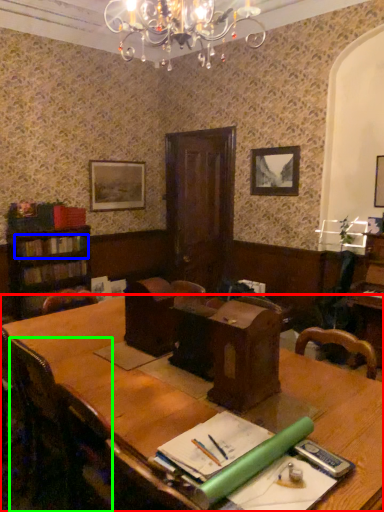
Question: Which is farther away from table (highlighted by a red box)? book (highlighted by a blue box) or chair (highlighted by a green box)?

Choices:
 (A) book
 (B) chair

Answer: (A)